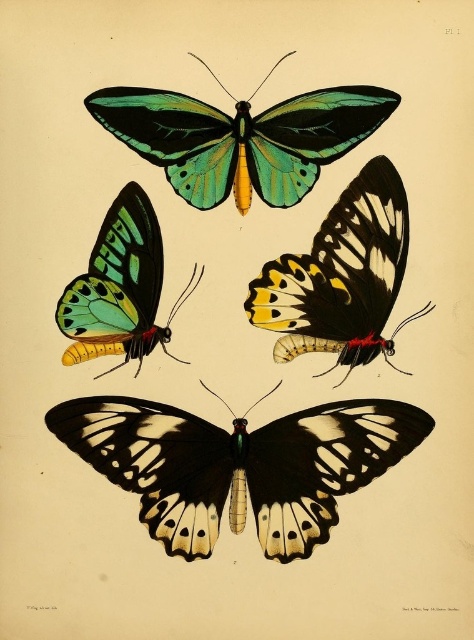
Who is lower down, black glossy butterfly at bottom or green glossy butterfly at upper center?

black glossy butterfly at bottom is lower down.

The width and height of the screenshot is (474, 640). What do you see at coordinates (238, 465) in the screenshot? I see `black glossy butterfly at bottom` at bounding box center [238, 465].

This screenshot has height=640, width=474. Describe the element at coordinates (238, 465) in the screenshot. I see `black glossy butterfly at bottom` at that location.

Locate an element on the screen. The width and height of the screenshot is (474, 640). black glossy butterfly at bottom is located at coordinates click(238, 465).

Can you confirm if green glossy butterfly at upper center is bigger than shiny green and yellow butterfly at upper left?

Indeed, green glossy butterfly at upper center has a larger size compared to shiny green and yellow butterfly at upper left.

Between green glossy butterfly at upper center and shiny green and yellow butterfly at upper left, which one has more height?

green glossy butterfly at upper center is taller.

The width and height of the screenshot is (474, 640). Describe the element at coordinates (340, 276) in the screenshot. I see `green glossy butterfly at upper center` at that location.

Locate an element on the screen. The height and width of the screenshot is (640, 474). green glossy butterfly at upper center is located at coordinates (340, 276).

Between point (304, 177) and point (151, 269), which one is positioned behind?

The point (304, 177) is behind.

Which of these two, shiny green and black butterfly at upper center or shiny green and yellow butterfly at upper left, stands shorter?

Standing shorter between the two is shiny green and black butterfly at upper center.

Between point (304, 170) and point (131, 260), which one is positioned in front?

Point (131, 260) is more forward.

Locate an element on the screen. shiny green and black butterfly at upper center is located at coordinates (242, 138).